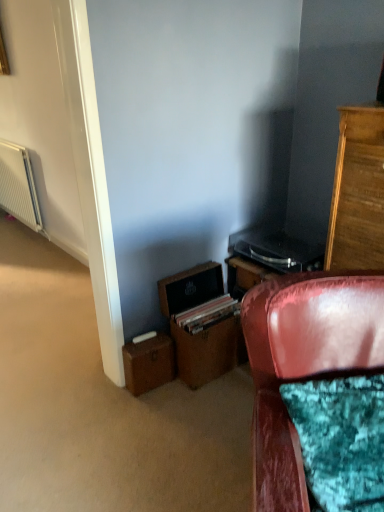
At what (x,y) coordinates should I click in order to perform the action: click on free area in between brown leather file cabinet at lower center and brown cardboard box at lower left. Please return your answer as a coordinate pair (x, y). Image resolution: width=384 pixels, height=512 pixels. Looking at the image, I should click on (167, 393).